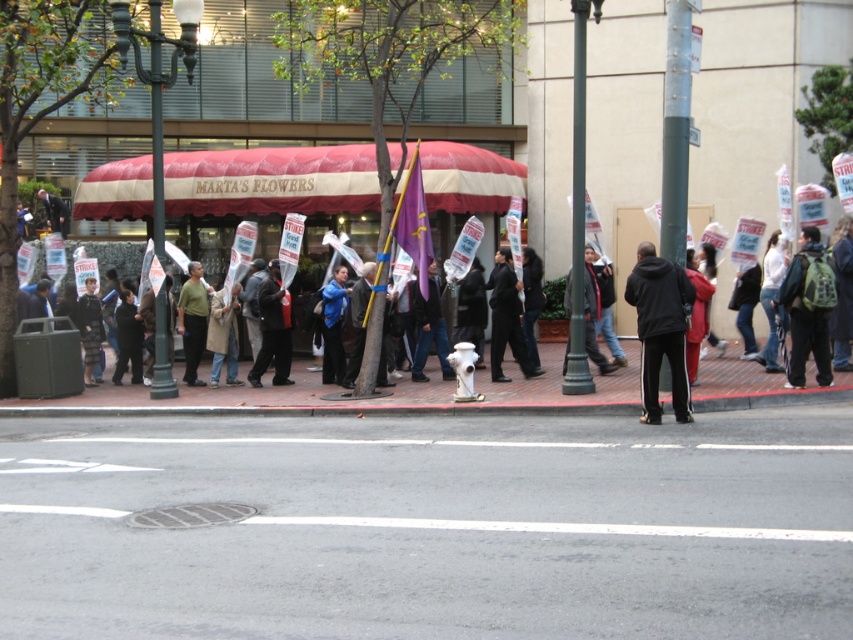
Is dark blue jacket at center taller than dark gray jacket at center?

In fact, dark blue jacket at center may be shorter than dark gray jacket at center.

Does point (218, 401) come farther from viewer compared to point (503, 250)?

No, it is not.

Identify the location of dark blue jacket at center. (236, 400).

Is point (287, 365) farther from viewer compared to point (532, 372)?

Yes, it is.

Between point (281, 368) and point (496, 344), which one is positioned in front?

Point (496, 344) is more forward.

The height and width of the screenshot is (640, 853). Identify the location of dark blue leather jacket at center. (273, 330).

Can you confirm if gray asphalt at lower center is thinner than dark gray jacket at center?

No.

Does gray asphalt at lower center appear on the left side of dark gray jacket at center?

Yes, gray asphalt at lower center is to the left of dark gray jacket at center.

Where is `gray asphalt at lower center`? gray asphalt at lower center is located at coordinates (428, 525).